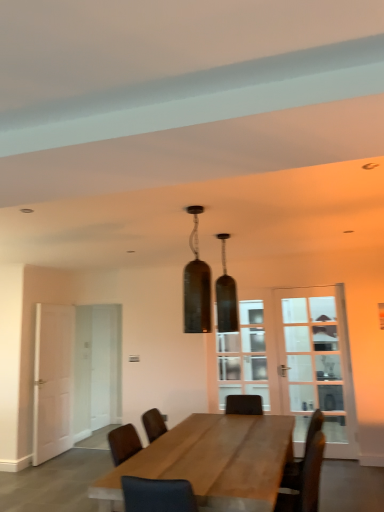
Locate an element on the screen. vacant space situated above matte glass pendant light at center, marked as the 1th lamp in a back-to-front arrangement (from a real-world perspective) is located at coordinates (228, 233).